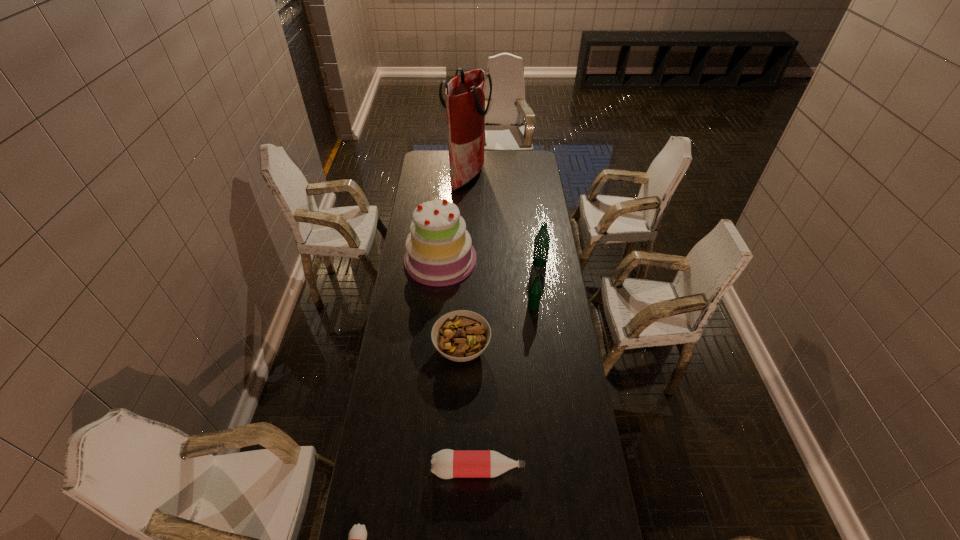
Locate an element on the screen. This screenshot has height=540, width=960. red grocery bag is located at coordinates (465, 94).

Where is `the tallest object`? This screenshot has width=960, height=540. the tallest object is located at coordinates (465, 94).

You are a GUI agent. You are given a task and a screenshot of the screen. Output one action in this format:
    pyautogui.click(x=<x>, y=<y>)
    Task: Click on the second tallest object
    This screenshot has width=960, height=540.
    Given the screenshot: What is the action you would take?
    pyautogui.click(x=439, y=252)

This screenshot has width=960, height=540. Find the location of `purple cake`. purple cake is located at coordinates (439, 252).

Where is `the farther green bottle`? The width and height of the screenshot is (960, 540). the farther green bottle is located at coordinates coord(542,240).

I want to click on the farthest bottle, so click(542, 240).

Where is `the fourth farthest object`? This screenshot has width=960, height=540. the fourth farthest object is located at coordinates (535, 290).

Identify the location of the second tallest bottle. (535, 290).

The width and height of the screenshot is (960, 540). What are the coordinates of `stew` in the screenshot? It's located at (461, 335).

Where is `the third nearest object`? This screenshot has height=540, width=960. the third nearest object is located at coordinates (461, 335).